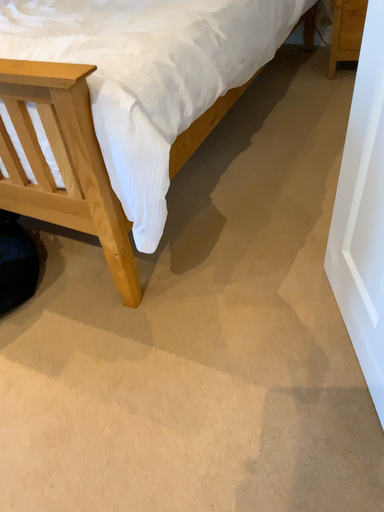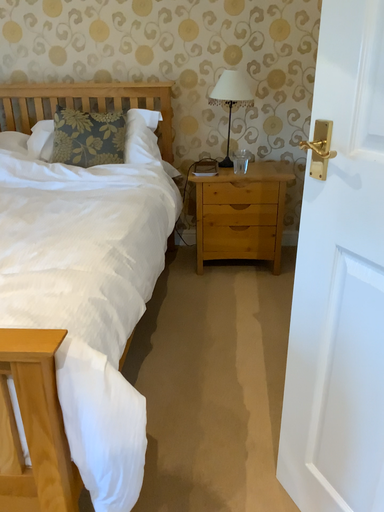
Question: Which way did the camera rotate in the video?

Choices:
 (A) rotated downward
 (B) rotated upward

Answer: (B)